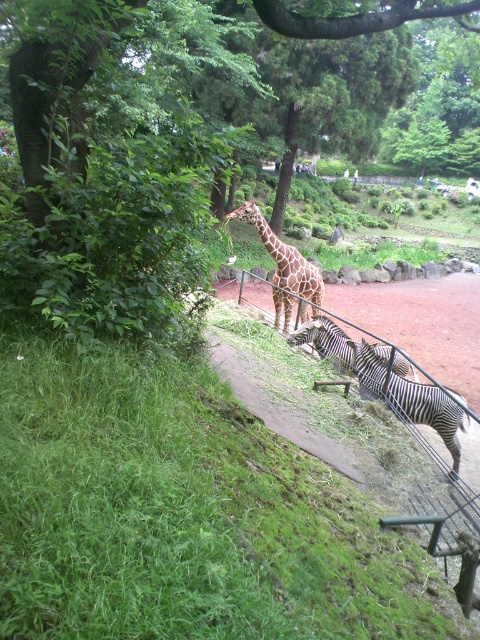
Question: Considering the real-world distances, which object is closest to the black and white striped zebra at center?

Choices:
 (A) white glossy zebra at center
 (B) black and white striped zebra at lower right
 (C) spotted giraffe at center

Answer: (B)

Question: Is spotted giraffe at center below black and white striped zebra at center?

Choices:
 (A) no
 (B) yes

Answer: (A)

Question: Can you confirm if black and white striped zebra at center is thinner than white glossy zebra at center?

Choices:
 (A) yes
 (B) no

Answer: (A)

Question: Observing the image, what is the correct spatial positioning of black and white striped zebra at center in reference to white glossy zebra at center?

Choices:
 (A) above
 (B) below

Answer: (B)

Question: Which point is farther to the camera?

Choices:
 (A) spotted giraffe at center
 (B) black and white striped zebra at lower right

Answer: (A)

Question: Based on their relative distances, which object is nearer to the black and white striped zebra at lower right?

Choices:
 (A) white glossy zebra at center
 (B) spotted giraffe at center
 (C) black and white striped zebra at center

Answer: (C)